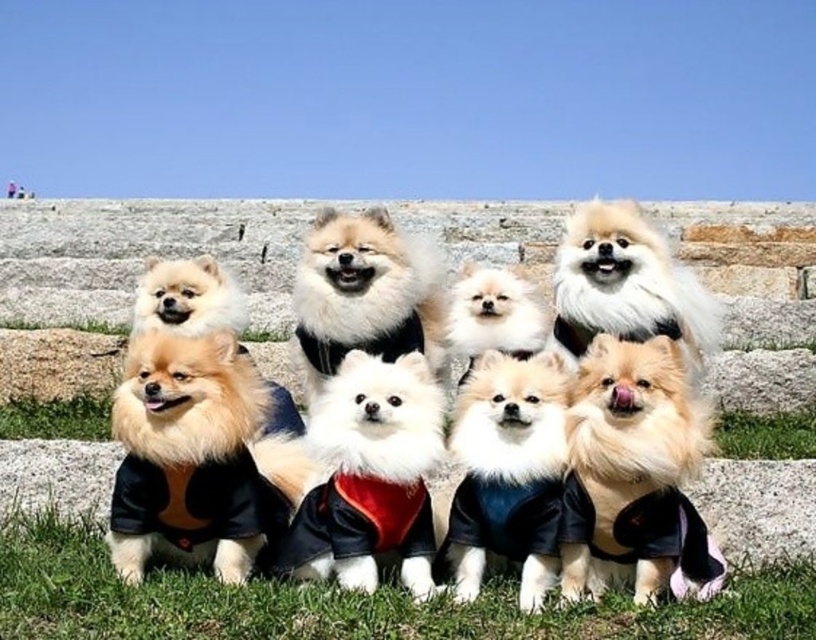
Question: Considering the real-world distances, which object is closest to the fluffy white fur at center?

Choices:
 (A) fluffy white dog at center
 (B) fluffy beige fur at center
 (C) green grass at lower center

Answer: (B)

Question: From the image, what is the correct spatial relationship of fluffy white dog at center in relation to white fluffy dog at center?

Choices:
 (A) right
 (B) left

Answer: (B)

Question: Among these objects, which one is nearest to the camera?

Choices:
 (A) fluffy white fur at center
 (B) fluffy beige fur at center

Answer: (B)

Question: Does green grass at lower center appear on the left side of white fluffy dog at center?

Choices:
 (A) no
 (B) yes

Answer: (B)

Question: Does green grass at lower center appear over fluffy white fur at center?

Choices:
 (A) yes
 (B) no

Answer: (B)

Question: Which of the following is the closest to the observer?

Choices:
 (A) fluffy white dog at center
 (B) fluffy beige fur at center

Answer: (B)